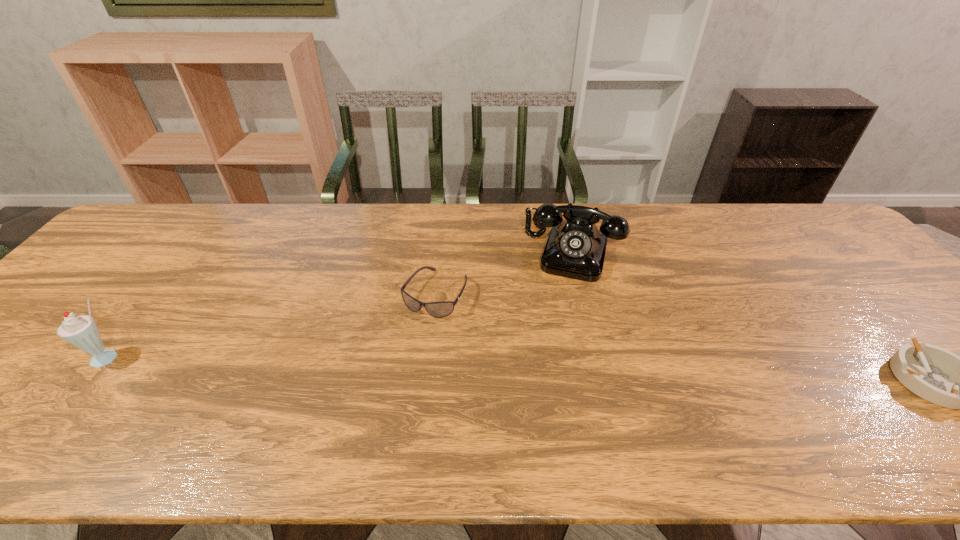
The width and height of the screenshot is (960, 540). In order to click on free space on the desktop that is between the milkshake and the ashtray and is positioned on the dial of the telephone in this screenshot , I will do [x=543, y=369].

Image resolution: width=960 pixels, height=540 pixels. Find the location of `free spot on the desktop that is between the leftmost object and the shortest object and is positioned on the lenses of the second object from left to right`. free spot on the desktop that is between the leftmost object and the shortest object and is positioned on the lenses of the second object from left to right is located at coordinates (394, 365).